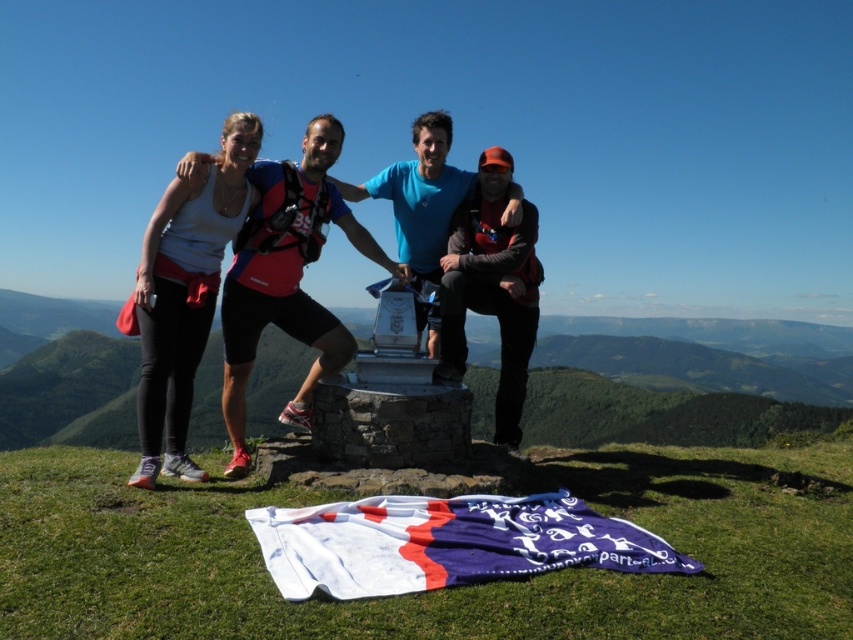
Does point (531, 493) come farther from viewer compared to point (463, 288)?

No.

Can you confirm if blue cotton flag at lower center is wider than matte gray backpack at center?

Correct, the width of blue cotton flag at lower center exceeds that of matte gray backpack at center.

Find the location of a particular element. The width and height of the screenshot is (853, 640). blue cotton flag at lower center is located at coordinates 445,544.

Identify the location of blue cotton flag at lower center. (445, 544).

The image size is (853, 640). What do you see at coordinates (287, 276) in the screenshot?
I see `matte blue shirt at center` at bounding box center [287, 276].

Measure the distance between matte blue shirt at center and camera.

matte blue shirt at center and camera are 18.75 feet apart.

In order to click on matte blue shirt at center in this screenshot , I will do `click(287, 276)`.

Between point (140, 451) and point (370, 195), which one is positioned in front?

Point (370, 195) is in front.

Based on the photo, does white matte tank top at upper left have a lesser width compared to blue fabric at center?

Yes.

Between point (163, 316) and point (415, 208), which one is positioned in front?

Point (163, 316) is in front.

Locate an element on the screen. This screenshot has height=640, width=853. white matte tank top at upper left is located at coordinates (184, 294).